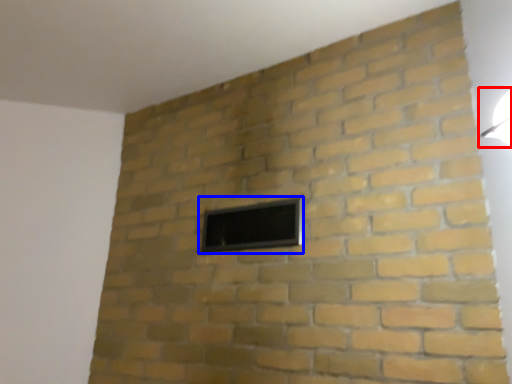
Question: Which object is closer to the camera taking this photo, light fixture (highlighted by a red box) or window (highlighted by a blue box)?

Choices:
 (A) light fixture
 (B) window

Answer: (A)